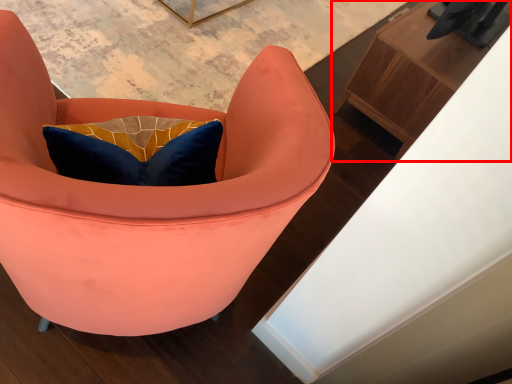
Question: Observing the image, what is the correct spatial positioning of furniture (annotated by the red box) in reference to chair?

Choices:
 (A) right
 (B) left

Answer: (A)